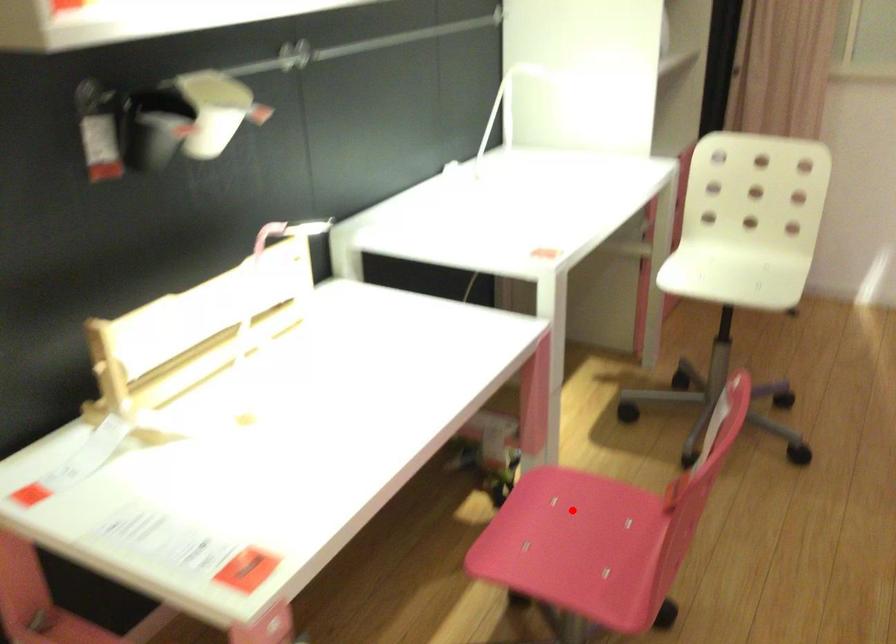
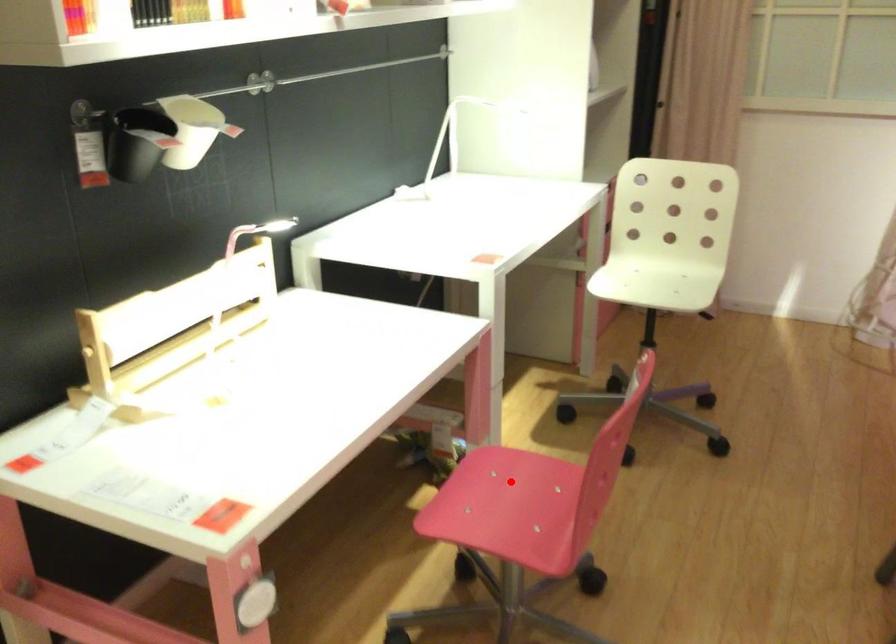
I am providing you with two images of the same scene from different viewpoints. A red point is marked on the first image and another point is marked on the second image. Is the red point in image1 aligned with the point shown in image2?

Yes